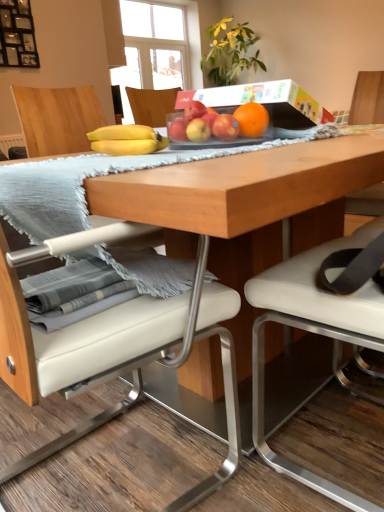
Question: Is white leather chair at center, marked as the 1th chair in a left-to-right arrangement, in front of or behind red matte apple at center, placed as the second apple when sorted from left to right, in the image?

Choices:
 (A) behind
 (B) front

Answer: (B)

Question: Is white leather chair at center, placed as the second chair when sorted from right to left, situated inside red matte apple at center, placed as the second apple when sorted from left to right, or outside?

Choices:
 (A) outside
 (B) inside

Answer: (A)

Question: Estimate the real-world distances between objects in this image. Which object is farther from the white leather chair at center, marked as the 1th chair in a left-to-right arrangement?

Choices:
 (A) yellow matte apple at center, which is counted as the 2th apple, starting from the right
 (B) white leather chair at center, positioned as the first chair in right-to-left order
 (C) yellow matte bananas at center
 (D) red matte apple at center, positioned as the first apple in right-to-left order
 (E) red matte apple at center, the 1th apple positioned from the left

Answer: (D)

Question: Which of these objects is positioned farthest from the white leather chair at center, placed as the second chair when sorted from right to left?

Choices:
 (A) white leather chair at center, positioned as the first chair in right-to-left order
 (B) red matte apple at center, the 1th apple positioned from the left
 (C) red matte apple at center, placed as the second apple when sorted from left to right
 (D) red matte apple at center, positioned as the first apple in right-to-left order
 (E) yellow matte apple at center, the 3th apple when ordered from left to right

Answer: (C)